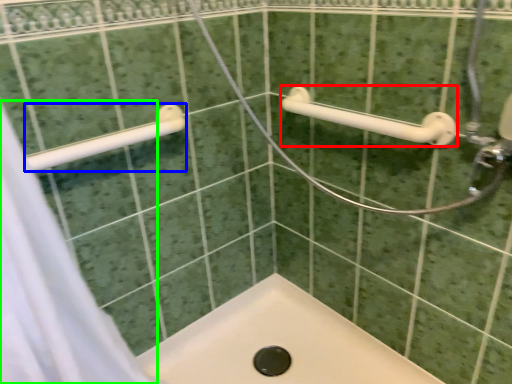
Question: Which object is the farthest from towel rack (highlighted by a red box)? Choose among these: towel rack (highlighted by a blue box) or shower curtain (highlighted by a green box).

Choices:
 (A) towel rack
 (B) shower curtain

Answer: (B)